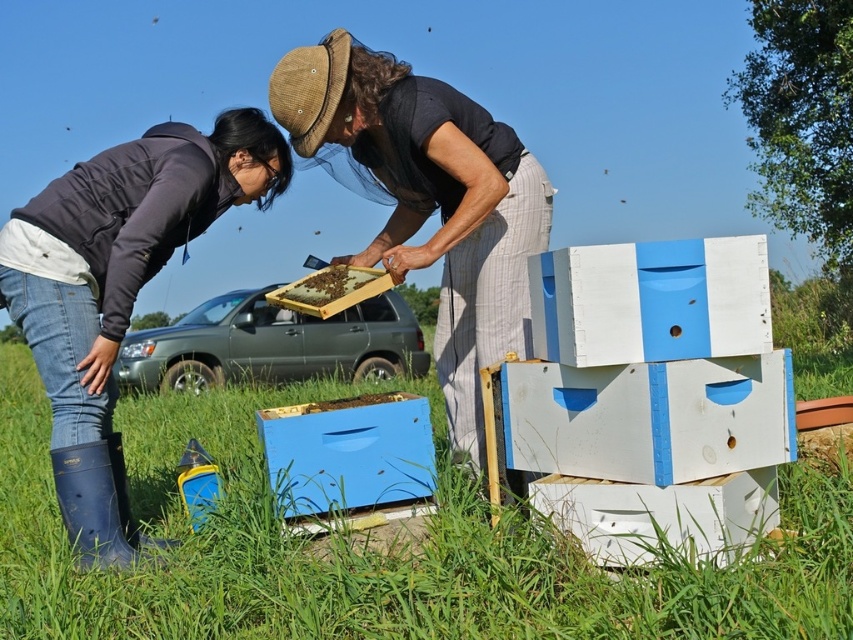
You are a beekeeper trying to maintain a safe distance of 3 meters between yourself and another worker for safety. You see the matte black shirt at center. Is your current distance sufficient?

The matte black shirt at center is 2.80 meters away. Since the required safe distance is 3 meters, your current distance of 2.80 meters is insufficient. Move back to ensure the 3 meter requirement is met.